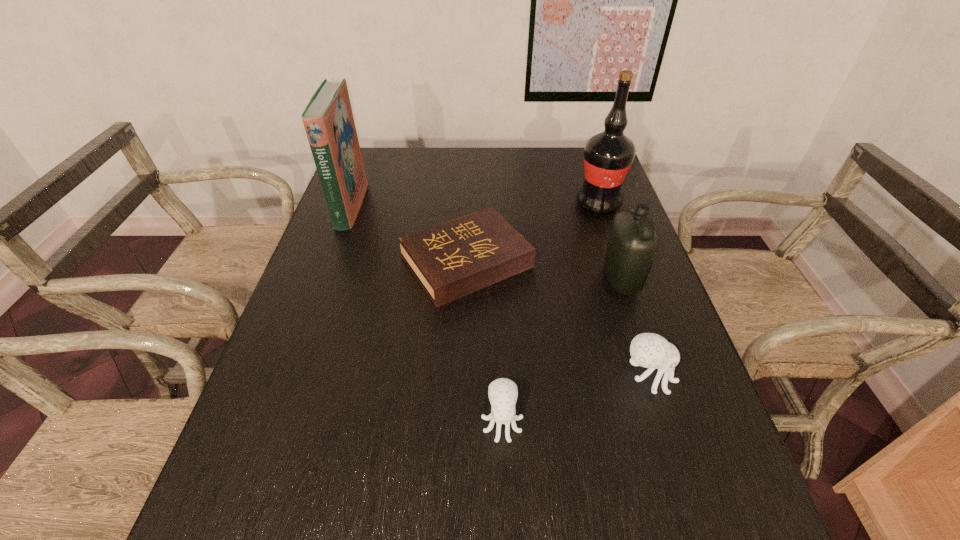
What are the coordinates of `vacant spot to place a octopus on the left` in the screenshot? It's located at (329, 475).